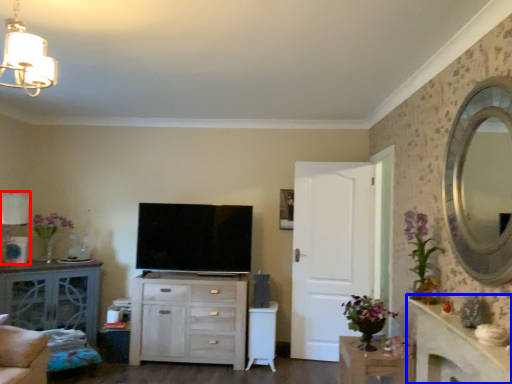
Question: Which object appears farthest to the camera in this image, lamp (highlighted by a red box) or counter top (highlighted by a blue box)?

Choices:
 (A) lamp
 (B) counter top

Answer: (A)